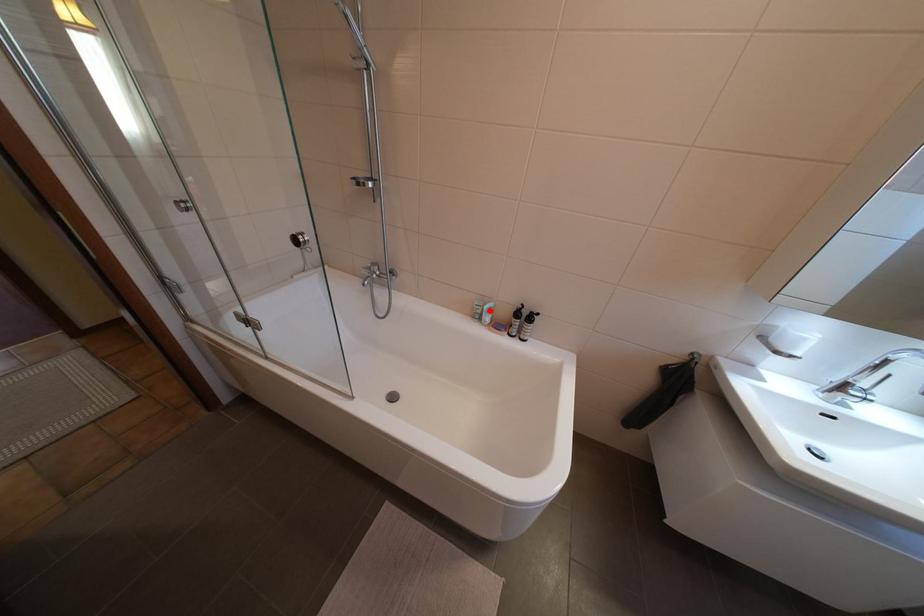
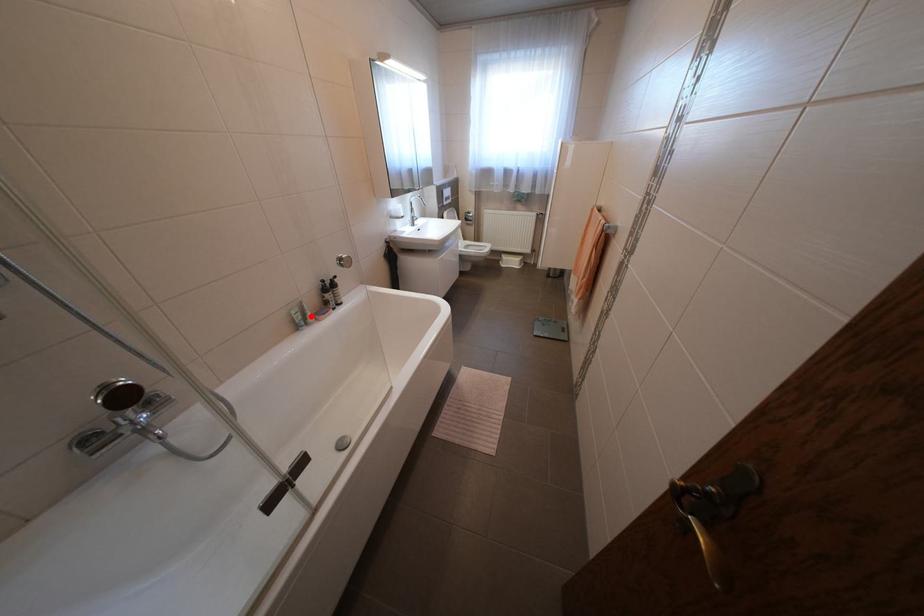
I am providing you with two images of the same scene from different viewpoints. A red point is marked on the first image and another point is marked on the second image. Is the marked point in image1 the same physical position as the marked point in image2?

Yes